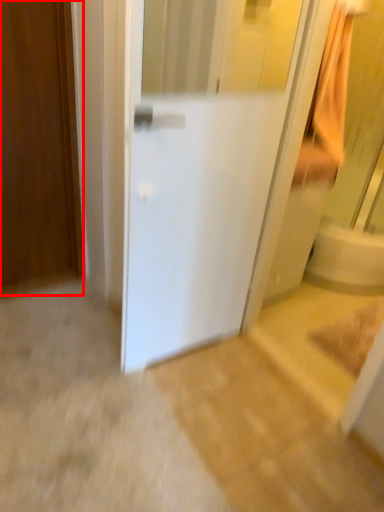
Question: From the image's perspective, where is door (annotated by the red box) located in relation to door in the image?

Choices:
 (A) above
 (B) below

Answer: (A)